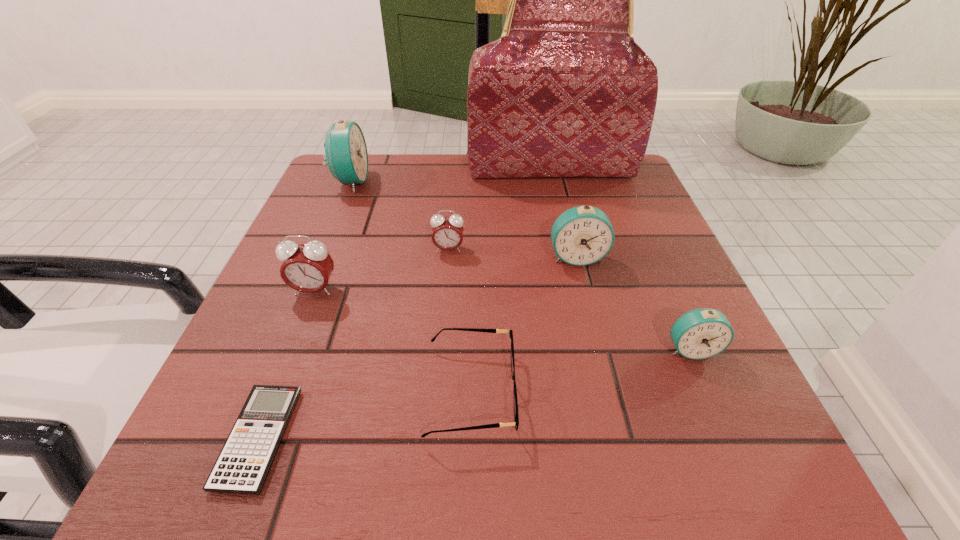
Where is `free space at the far edge`? The width and height of the screenshot is (960, 540). free space at the far edge is located at coordinates (461, 176).

Find the location of a particular element. The image size is (960, 540). vacant space at the near edge of the desktop is located at coordinates (639, 456).

The width and height of the screenshot is (960, 540). I want to click on free location at the left edge of the desktop, so click(x=373, y=209).

The image size is (960, 540). In the image, there is a desktop. Find the location of `vacant space at the right edge`. vacant space at the right edge is located at coordinates (612, 279).

Identify the location of vacant space at the far left corner. (356, 192).

In order to click on vacant space at the far right corner in this screenshot , I will do `click(599, 184)`.

In the image, there is a desktop. Identify the location of vacant space at the near right corner. point(756,443).

You are a GUI agent. You are given a task and a screenshot of the screen. Output one action in this format:
    pyautogui.click(x=<x>, y=<y>)
    Task: Click on the free space between the second biggest blue alarm clock and the handbag
    This screenshot has height=540, width=960.
    Given the screenshot: What is the action you would take?
    pyautogui.click(x=564, y=212)

Locate an element on the screen. vacant space that is in between the fourth farthest alarm clock and the smaller pink alarm clock is located at coordinates (381, 269).

The image size is (960, 540). In order to click on unoccupied position between the second blue alarm clock from right to left and the shortest object in this screenshot , I will do `click(418, 348)`.